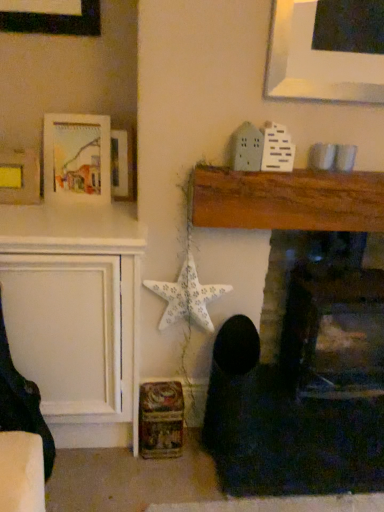
Where is `vacant region above wooden fireplace at center, the 2th fireplace in the right-to-left sequence (from a real-world perspective)`? Image resolution: width=384 pixels, height=512 pixels. vacant region above wooden fireplace at center, the 2th fireplace in the right-to-left sequence (from a real-world perspective) is located at coordinates click(316, 154).